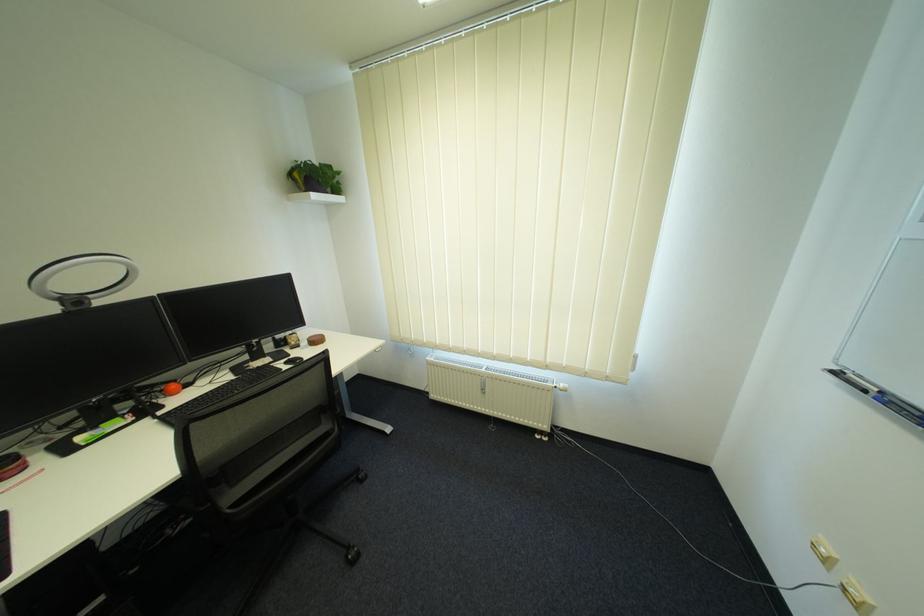
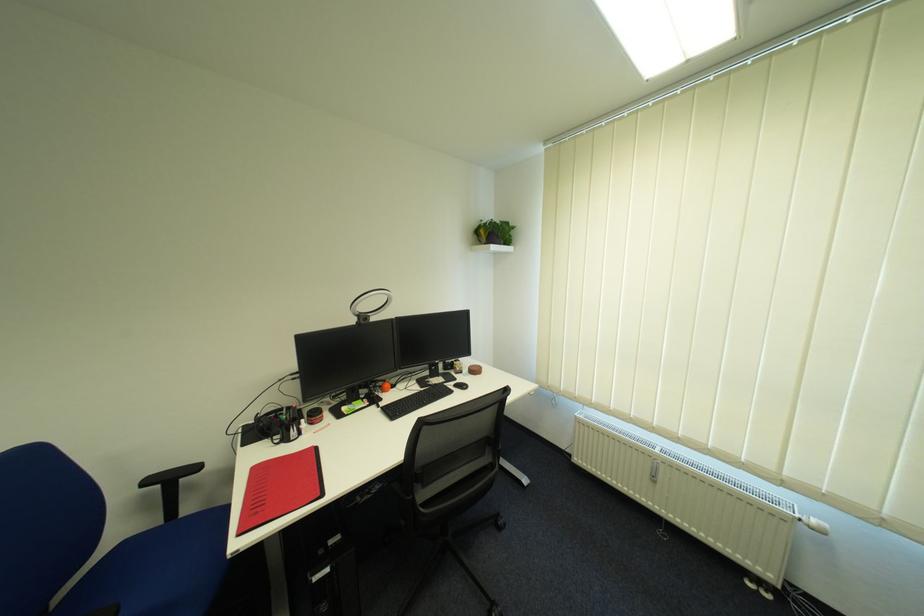
Where in the second image is the point corresponding to the point at 394,342 from the first image?

(548, 387)